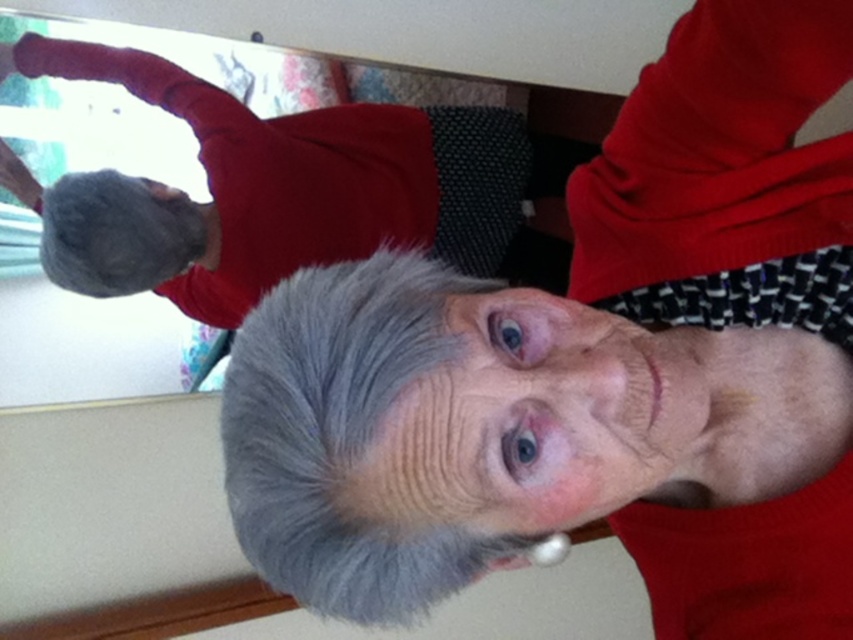
Question: Based on their relative distances, which object is farther from the gray hair at center?

Choices:
 (A) gray wool sweater at upper left
 (B) fuzzy wool glove at upper left
 (C) gray fluffy hair at center

Answer: (B)

Question: Estimate the real-world distances between objects in this image. Which object is farther from the gray fluffy hair at center?

Choices:
 (A) fuzzy wool glove at upper left
 (B) gray hair at center

Answer: (A)

Question: Can you confirm if gray hair at center is thinner than fuzzy wool glove at upper left?

Choices:
 (A) no
 (B) yes

Answer: (A)

Question: Is gray fluffy hair at center positioned at the back of fuzzy wool glove at upper left?

Choices:
 (A) yes
 (B) no

Answer: (B)

Question: Which object is farther from the camera taking this photo?

Choices:
 (A) gray wool sweater at upper left
 (B) gray fluffy hair at center

Answer: (A)

Question: Does gray hair at center come behind gray fluffy hair at center?

Choices:
 (A) no
 (B) yes

Answer: (B)